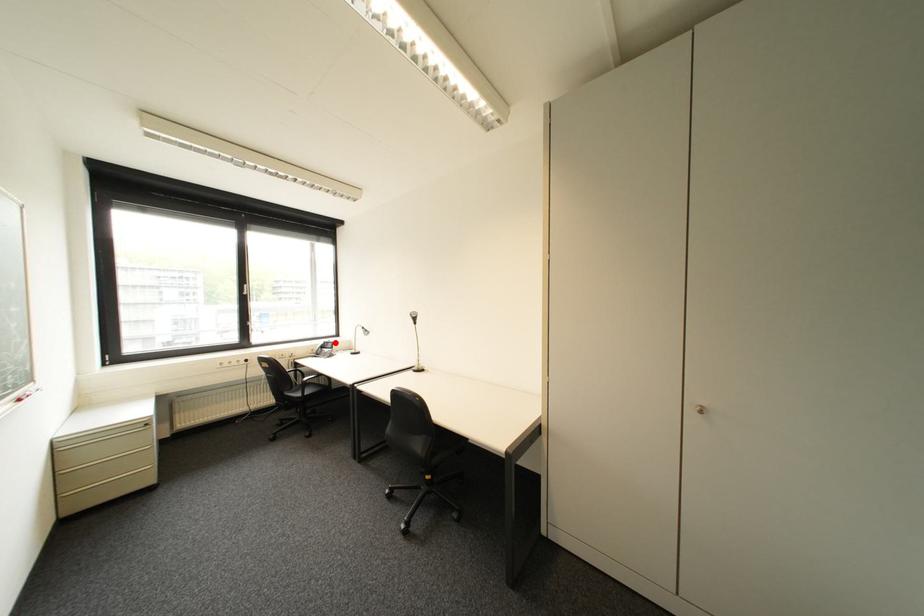
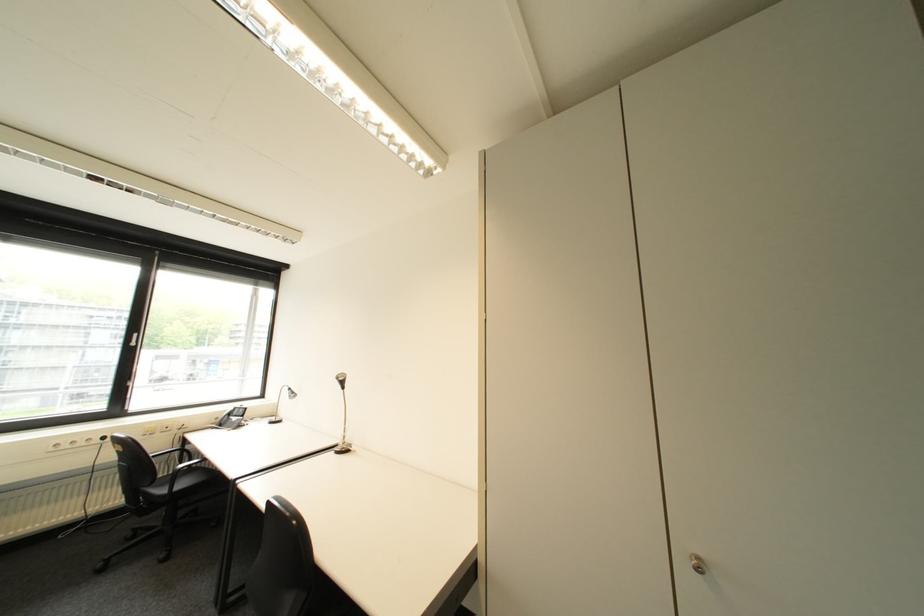
The point at the highlighted location is marked in the first image. Where is the corresponding point in the second image?

(246, 408)